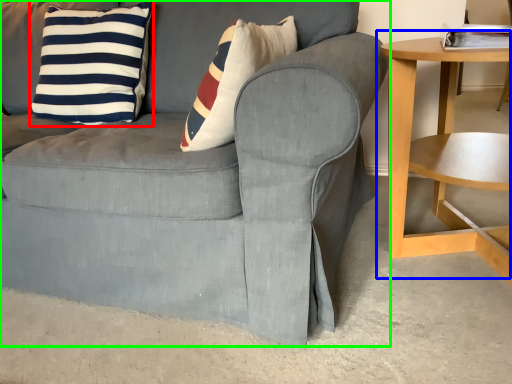
Question: Considering the real-world distances, which object is farthest from pillow (highlighted by a red box)? table (highlighted by a blue box) or chair (highlighted by a green box)?

Choices:
 (A) table
 (B) chair

Answer: (A)